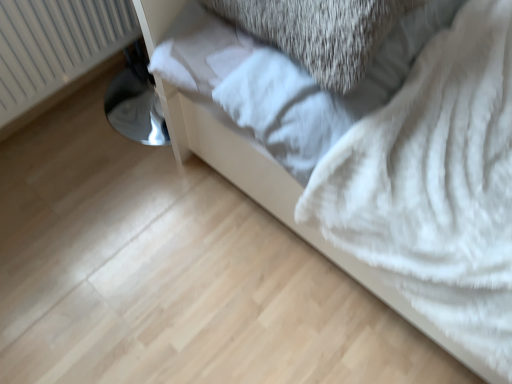
Question: Does white plastic radiator at left have a larger size compared to white fluffy blanket at lower right?

Choices:
 (A) no
 (B) yes

Answer: (A)

Question: Can you confirm if white plastic radiator at left is positioned to the left of white fluffy blanket at lower right?

Choices:
 (A) yes
 (B) no

Answer: (A)

Question: From the image's perspective, is white plastic radiator at left below white fluffy blanket at lower right?

Choices:
 (A) no
 (B) yes

Answer: (B)

Question: Is white plastic radiator at left taller than white fluffy blanket at lower right?

Choices:
 (A) yes
 (B) no

Answer: (B)

Question: Is white plastic radiator at left touching white fluffy blanket at lower right?

Choices:
 (A) yes
 (B) no

Answer: (B)

Question: Can you confirm if white plastic radiator at left is positioned to the right of white fluffy blanket at lower right?

Choices:
 (A) no
 (B) yes

Answer: (A)

Question: Considering the relative sizes of white fluffy blanket at lower right and white fluffy sheet at center in the image provided, is white fluffy blanket at lower right smaller than white fluffy sheet at center?

Choices:
 (A) no
 (B) yes

Answer: (A)

Question: Could white fluffy sheet at center be considered to be inside white fluffy blanket at lower right?

Choices:
 (A) no
 (B) yes

Answer: (B)

Question: Considering the relative positions of white fluffy blanket at lower right and white fluffy sheet at center in the image provided, is white fluffy blanket at lower right to the left of white fluffy sheet at center from the viewer's perspective?

Choices:
 (A) yes
 (B) no

Answer: (B)

Question: Is white fluffy blanket at lower right bigger than white fluffy sheet at center?

Choices:
 (A) yes
 (B) no

Answer: (A)

Question: Can you see white fluffy blanket at lower right touching white fluffy sheet at center?

Choices:
 (A) yes
 (B) no

Answer: (B)

Question: Considering the relative positions of white fluffy blanket at lower right and white fluffy sheet at center in the image provided, is white fluffy blanket at lower right in front of white fluffy sheet at center?

Choices:
 (A) no
 (B) yes

Answer: (B)

Question: From a real-world perspective, is white fluffy sheet at center physically below white fluffy blanket at lower right?

Choices:
 (A) yes
 (B) no

Answer: (B)